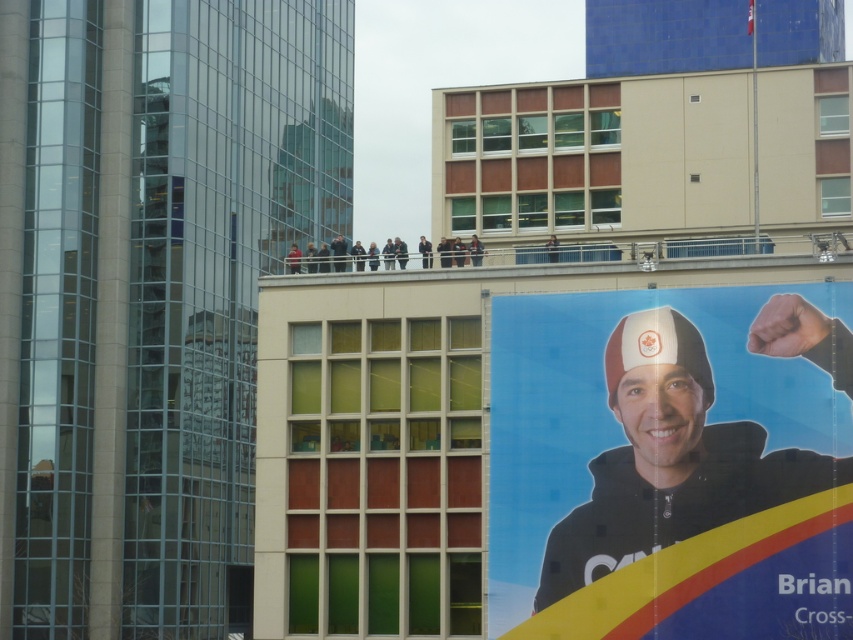
You are an artist who wants to paint a mural that covers both the matte black poster at right and the matte black jacket at upper center. Which object requires a larger canvas in terms of height?

The matte black poster at right is taller than the matte black jacket at upper center, so it requires a larger canvas in terms of height.

You are standing in the urban setting described. You see the matte black poster at right and the matte black jacket at upper center. Which object is nearer to you?

The matte black poster at right is closer to the viewer than the matte black jacket at upper center.

You are standing in the urban setting described. You need to locate the matte black poster at right. Based on its coordinates, where would you look relative to the other buildings?

The matte black poster at right is located at coordinates 0.725 on the x axis and 0.788 on the y axis, which places it in the upper right quadrant of the image, positioned to the right of the beige building and above the glass building.